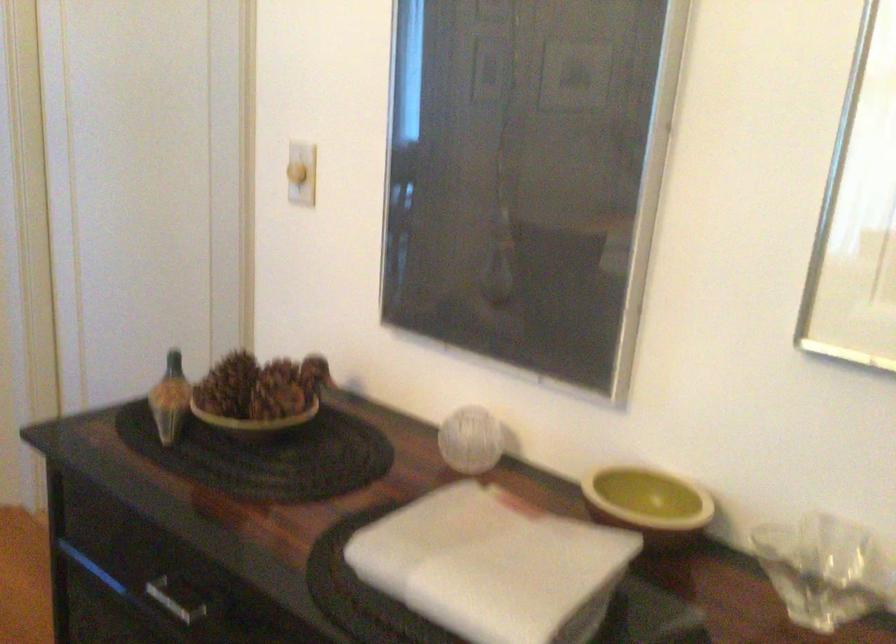
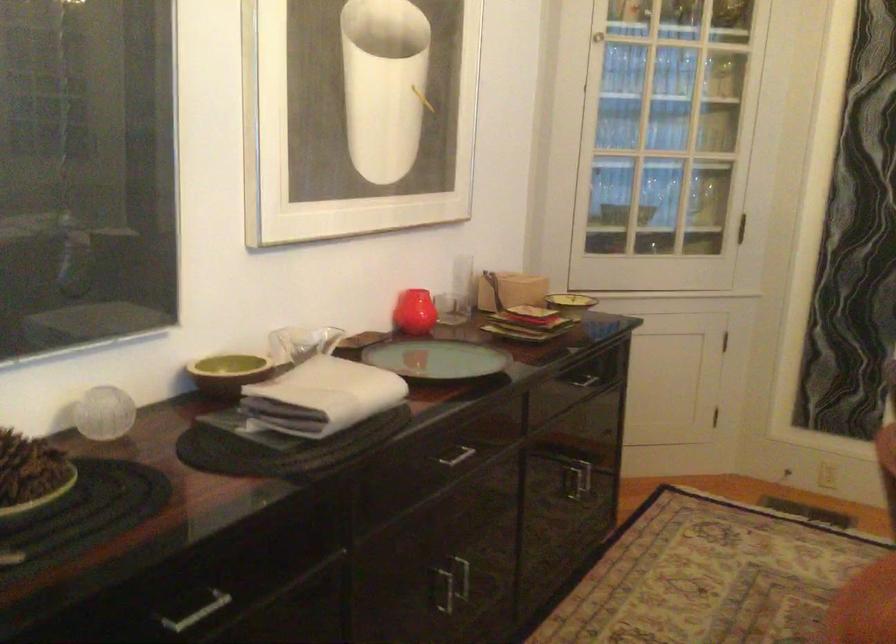
In the second image, find the point that corresponds to point (442, 417) in the first image.

(104, 413)